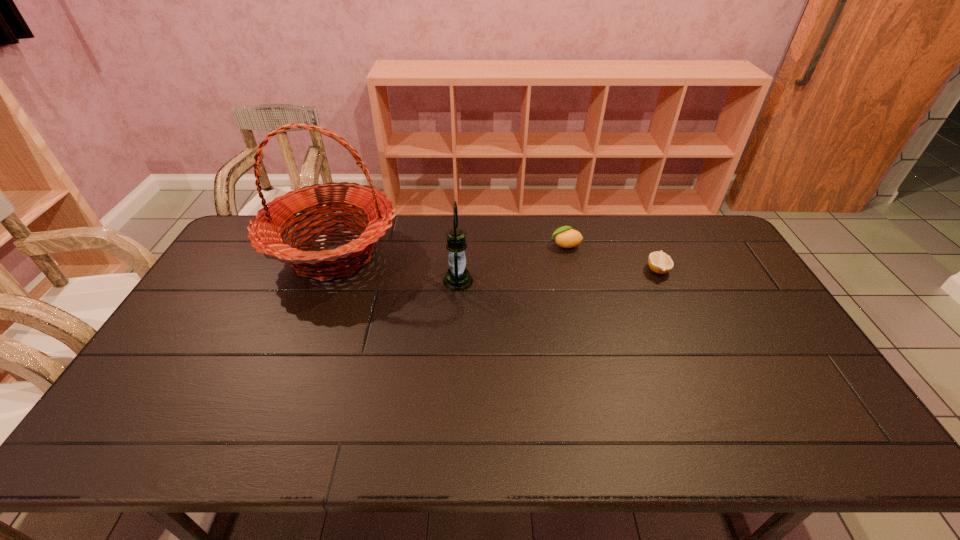
In order to click on vacant space positioned 0.150m with leaves positioned above the third object from left to right in this screenshot , I will do `click(506, 245)`.

Where is `blank area located with leaves positioned above the third object from left to right`? This screenshot has width=960, height=540. blank area located with leaves positioned above the third object from left to right is located at coordinates (468, 245).

I want to click on free space located with leaves positioned above the third object from left to right, so click(523, 245).

Find the location of a particular element. The height and width of the screenshot is (540, 960). vacant space located on the right of the shorter lemon is located at coordinates (707, 270).

The width and height of the screenshot is (960, 540). In order to click on basket that is at the far edge in this screenshot , I will do (265, 233).

Where is `lemon that is at the far edge`? The height and width of the screenshot is (540, 960). lemon that is at the far edge is located at coordinates [565, 237].

This screenshot has height=540, width=960. In order to click on object positioned at the left edge in this screenshot , I will do pyautogui.click(x=265, y=233).

Where is `object located in the far left corner section of the desktop`? object located in the far left corner section of the desktop is located at coordinates (265, 233).

In the image, there is a desktop. In order to click on free space at the far edge in this screenshot , I will do `click(453, 216)`.

The width and height of the screenshot is (960, 540). I want to click on free space at the near edge of the desktop, so click(455, 428).